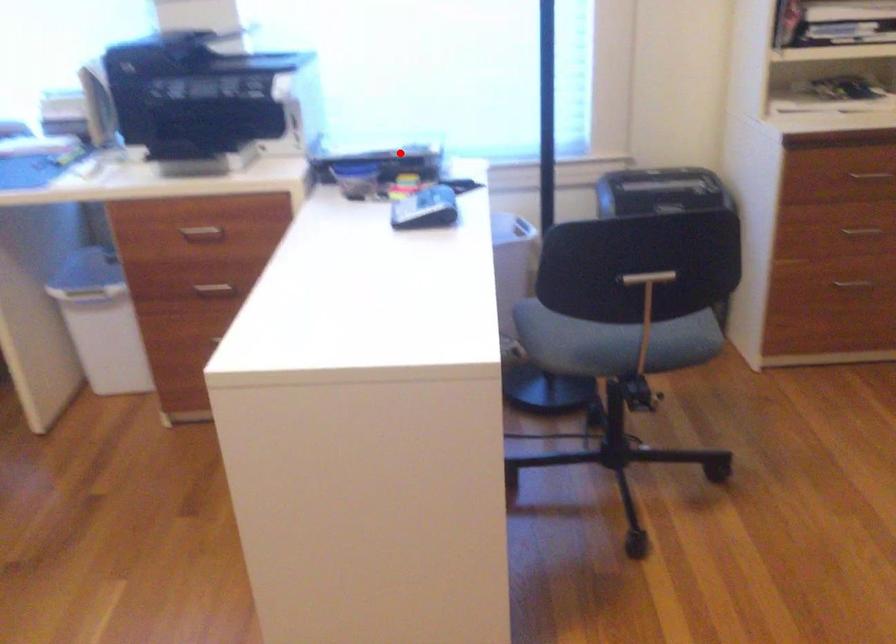
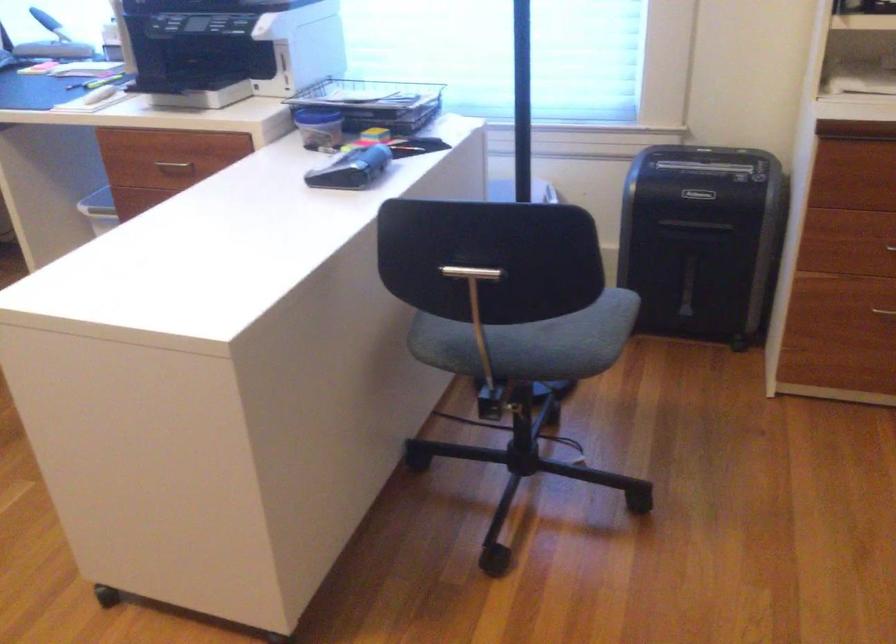
Question: I am providing you with two images of the same scene from different viewpoints. A red point is marked on the first image. At the location where the point appears in image 1, is it still visible in image 2?

Choices:
 (A) Yes
 (B) No

Answer: (A)